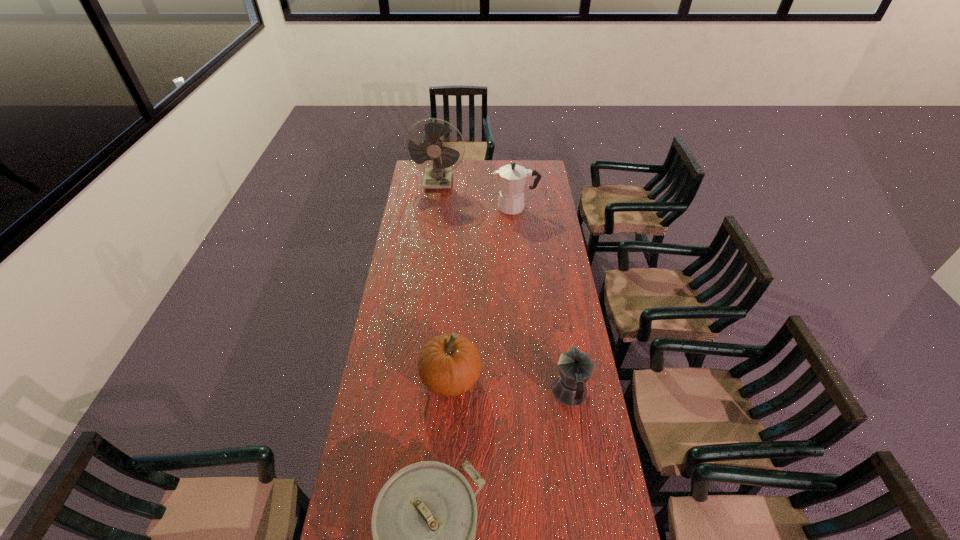
You are a GUI agent. You are given a task and a screenshot of the screen. Output one action in this format:
    pyautogui.click(x=<x>, y=<y>)
    Task: Click on the empty space between the nearer coffeepot and the pumpkin
    
    Given the screenshot: What is the action you would take?
    pyautogui.click(x=511, y=386)

In order to click on unoccupied position between the fan and the shorter coffeepot in this screenshot , I will do `click(504, 287)`.

This screenshot has width=960, height=540. Find the location of `empty location between the farthest object and the nearer coffeepot`. empty location between the farthest object and the nearer coffeepot is located at coordinates (504, 287).

The image size is (960, 540). Find the location of `free area in between the nearer coffeepot and the pumpkin`. free area in between the nearer coffeepot and the pumpkin is located at coordinates (511, 386).

Where is `free space between the second farthest object and the fan`? Image resolution: width=960 pixels, height=540 pixels. free space between the second farthest object and the fan is located at coordinates (477, 194).

The width and height of the screenshot is (960, 540). Identify the location of unoccupied area between the nearer coffeepot and the pumpkin. (511, 386).

Locate which object is the third closest to the farther coffeepot. Please provide its 2D coordinates. Your answer should be formatted as a tuple, i.e. [(x, y)], where the tuple contains the x and y coordinates of a point satisfying the conditions above.

[(575, 368)]

Point out which object is positioned as the third nearest to the nearest object. Please provide its 2D coordinates. Your answer should be formatted as a tuple, i.e. [(x, y)], where the tuple contains the x and y coordinates of a point satisfying the conditions above.

[(512, 177)]

I want to click on vacant region that satisfies the following two spatial constraints: 1. at the spout of the nearer coffeepot; 2. at the spout of the second farthest object, so click(540, 207).

This screenshot has height=540, width=960. Identify the location of vacant space that satisfies the following two spatial constraints: 1. at the spout of the shorter coffeepot; 2. at the spout of the taller coffeepot. (540, 207).